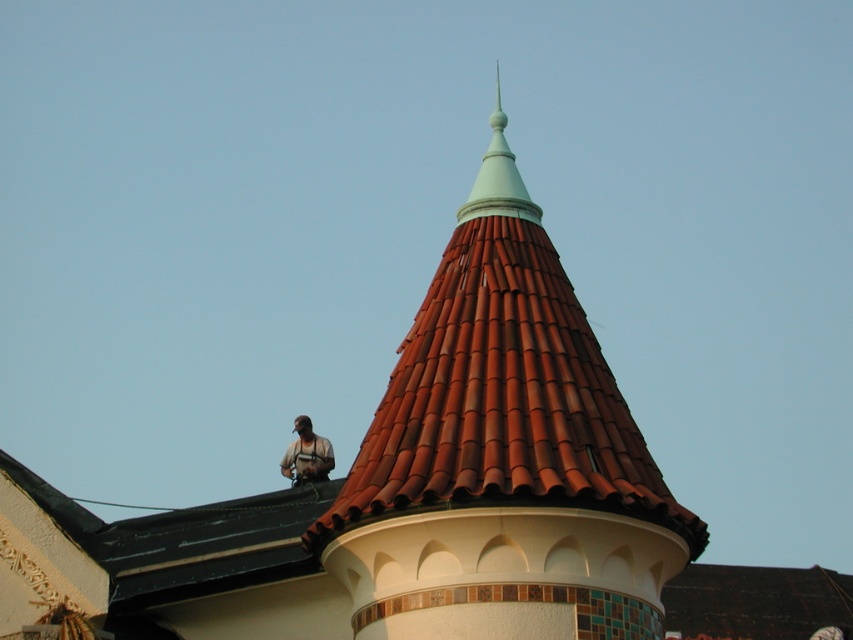
Is light teal plastic spire at upper center smaller than camouflage fabric shirt at upper center?

Incorrect, light teal plastic spire at upper center is not smaller in size than camouflage fabric shirt at upper center.

Does light teal plastic spire at upper center have a greater height compared to camouflage fabric shirt at upper center?

Yes.

This screenshot has width=853, height=640. I want to click on light teal plastic spire at upper center, so click(498, 177).

Can you confirm if brown tile roof at upper center is shorter than camouflage fabric shirt at upper center?

No.

Image resolution: width=853 pixels, height=640 pixels. I want to click on brown tile roof at upper center, so click(503, 456).

What are the coordinates of `brown tile roof at upper center` in the screenshot? It's located at (503, 456).

Based on the photo, is brown tile roof at upper center thinner than light teal plastic spire at upper center?

Incorrect, brown tile roof at upper center's width is not less than light teal plastic spire at upper center's.

Does brown tile roof at upper center appear over light teal plastic spire at upper center?

No, brown tile roof at upper center is not above light teal plastic spire at upper center.

Does point (547, 273) lie in front of point (502, 134)?

Yes, point (547, 273) is closer to viewer.

The image size is (853, 640). I want to click on brown tile roof at upper center, so click(x=503, y=456).